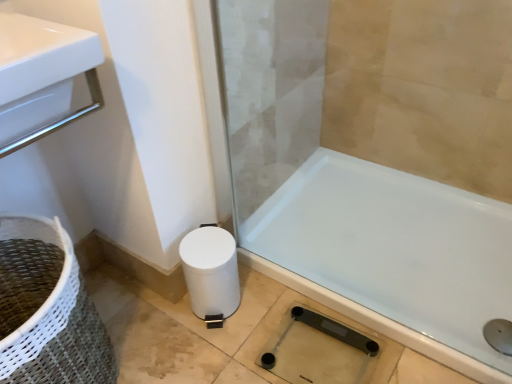
Locate an element on the screen. free location to the left of white matte toilet paper at lower left is located at coordinates (157, 326).